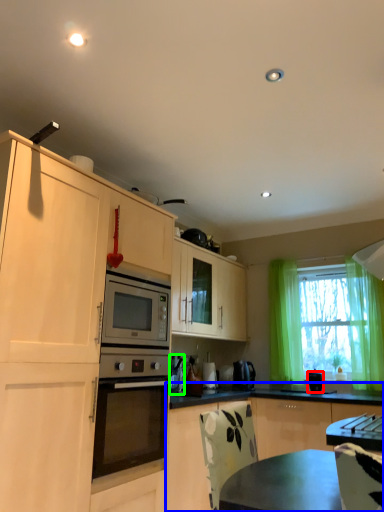
Question: Based on their relative distances, which object is farther from appliance (highlighted by a red box)? Choose from cabinetry (highlighted by a blue box) and appliance (highlighted by a green box).

Choices:
 (A) cabinetry
 (B) appliance

Answer: (B)